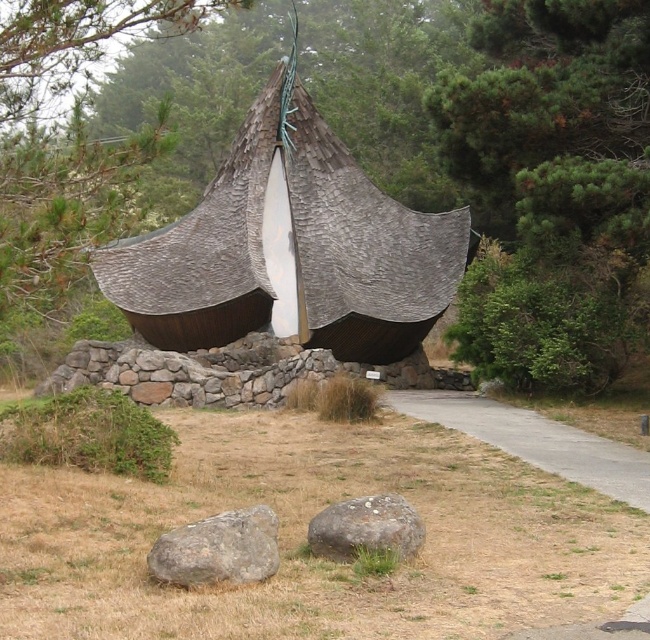
Is rustic wood gazebo at center to the left of gray rough rock at lower left from the viewer's perspective?

Correct, you'll find rustic wood gazebo at center to the left of gray rough rock at lower left.

Locate an element on the screen. The height and width of the screenshot is (640, 650). rustic wood gazebo at center is located at coordinates (291, 248).

Between point (380, 317) and point (192, 538), which one is positioned in front?

Positioned in front is point (192, 538).

What are the coordinates of `rustic wood gazebo at center` in the screenshot? It's located at (291, 248).

Does point (148, 253) come in front of point (601, 442)?

That is False.

Is point (312, 330) more distant than point (575, 451)?

Yes, point (312, 330) is farther from viewer.

Where is `rustic wood gazebo at center`? Image resolution: width=650 pixels, height=640 pixels. rustic wood gazebo at center is located at coordinates (291, 248).

Does gray concrete path at center appear on the right side of gray rough rock at lower left?

Yes, gray concrete path at center is to the right of gray rough rock at lower left.

Who is more distant from viewer, (x=598, y=477) or (x=224, y=573)?

Positioned behind is point (x=598, y=477).

Identify the location of gray concrete path at center. This screenshot has height=640, width=650. (536, 440).